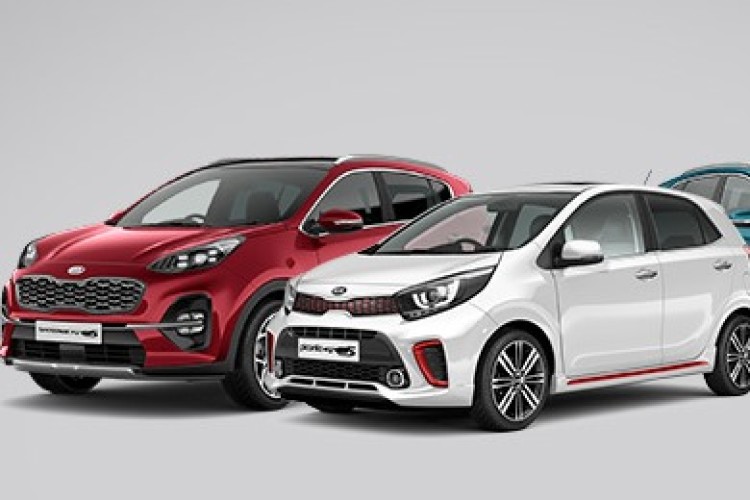
Where is `wall`? The width and height of the screenshot is (750, 500). wall is located at coordinates (304, 92).